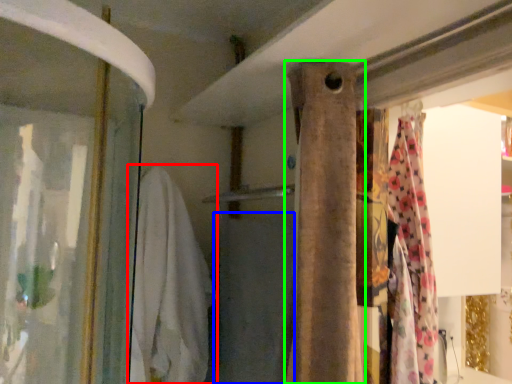
Question: Based on their relative distances, which object is nearer to clothing (highlighted by a red box)? Choose from bath towel (highlighted by a blue box) and curtain (highlighted by a green box).

Choices:
 (A) bath towel
 (B) curtain

Answer: (A)